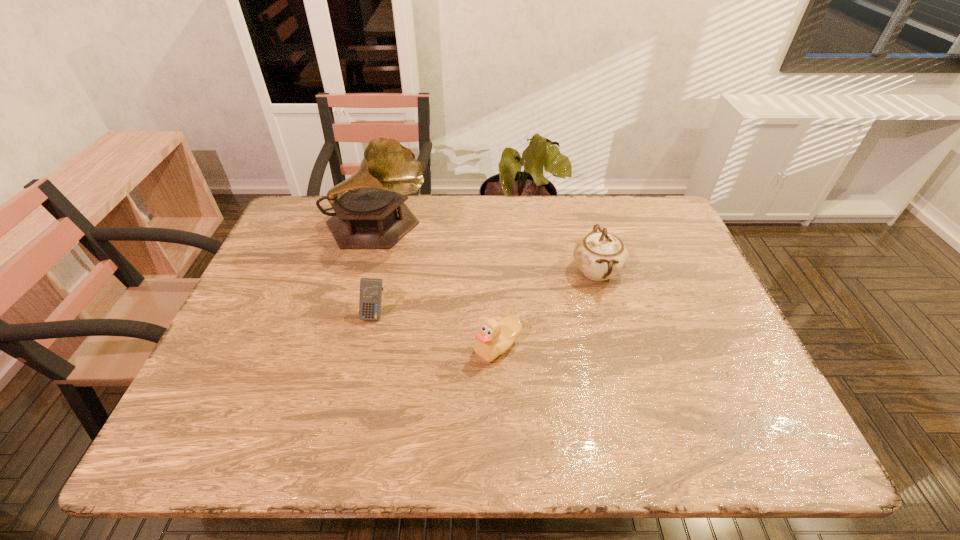
I want to click on unoccupied area between the tallest object and the second tallest object, so click(x=487, y=249).

This screenshot has width=960, height=540. I want to click on vacant area that lies between the second object from right to left and the chinaware, so click(547, 309).

Image resolution: width=960 pixels, height=540 pixels. What are the coordinates of `object that can be found as the closest to the duck` in the screenshot? It's located at (600, 255).

Identify which object is located as the second nearest to the calculator. Please provide its 2D coordinates. Your answer should be formatted as a tuple, i.e. [(x, y)], where the tuple contains the x and y coordinates of a point satisfying the conditions above.

[(494, 338)]

Locate an element on the screen. Image resolution: width=960 pixels, height=540 pixels. free spot that satisfies the following two spatial constraints: 1. on the horn direction of the phonograph record; 2. on the left side of the chinaware is located at coordinates (366, 271).

Identify the location of free location that satisfies the following two spatial constraints: 1. on the back side of the rightmost object; 2. on the horn direction of the phonograph record. The height and width of the screenshot is (540, 960). (585, 227).